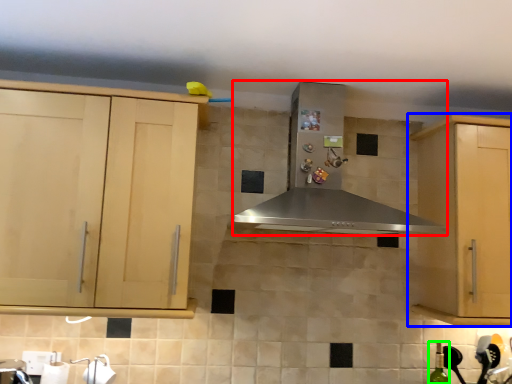
Question: Which object is the farthest from home appliance (highlighted by a red box)? Choose among these: cabinetry (highlighted by a blue box) or bottle (highlighted by a green box).

Choices:
 (A) cabinetry
 (B) bottle

Answer: (B)